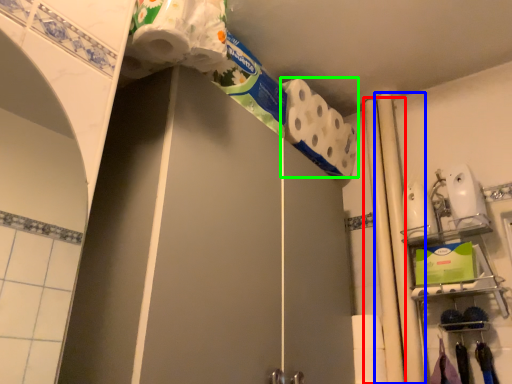
Question: Which is nearer to the beam (highlighted by a red box)? beam (highlighted by a blue box) or toilet paper (highlighted by a green box).

Choices:
 (A) beam
 (B) toilet paper

Answer: (A)